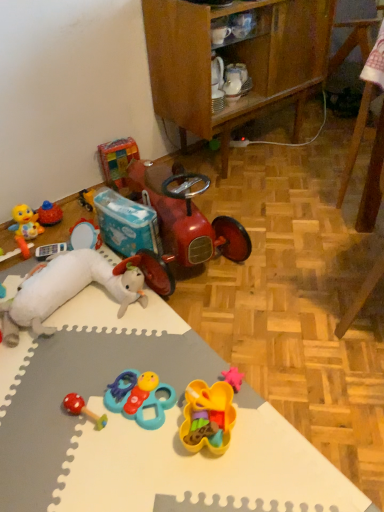
Where is `free space behind translucent plastic toy at center, which is the first toy in front-to-back order`? This screenshot has height=512, width=384. free space behind translucent plastic toy at center, which is the first toy in front-to-back order is located at coordinates (190, 361).